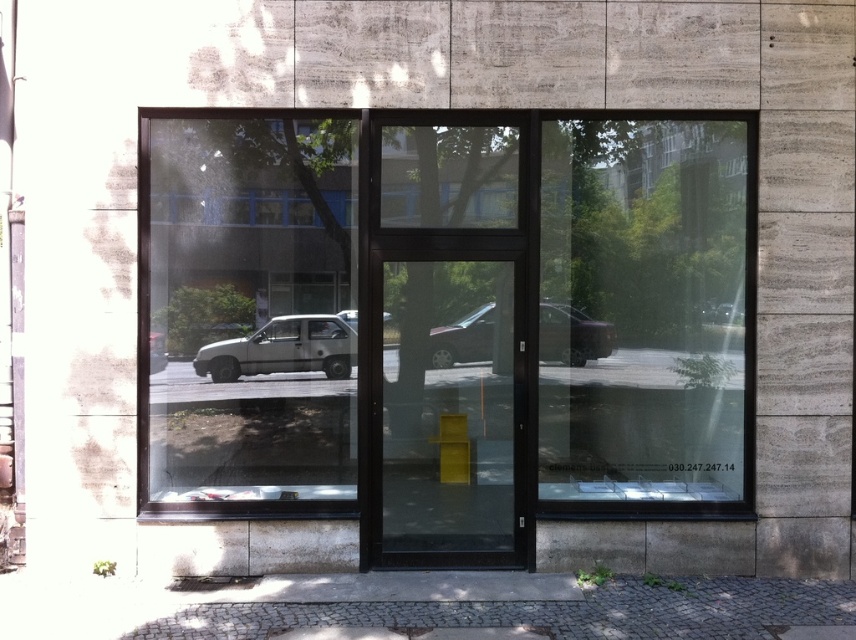
From the picture: Does silver metallic car at center appear over metallic silver car at center?

No, silver metallic car at center is not above metallic silver car at center.

Does point (286, 349) come in front of point (550, 339)?

Yes, it is.

This screenshot has width=856, height=640. I want to click on silver metallic car at center, so click(282, 349).

Does transparent glass window at left have a greater height compared to metallic silver car at center?

Indeed, transparent glass window at left has a greater height compared to metallic silver car at center.

Does point (161, 372) lie behind point (450, 349)?

No.

I want to click on transparent glass window at left, so click(251, 308).

Does transparent glass window at left have a lesser height compared to silver metallic car at center?

Incorrect, transparent glass window at left's height does not fall short of silver metallic car at center's.

Is point (212, 403) farther from viewer compared to point (325, 369)?

Yes.

Find the location of a particular element. The width and height of the screenshot is (856, 640). transparent glass window at left is located at coordinates (251, 308).